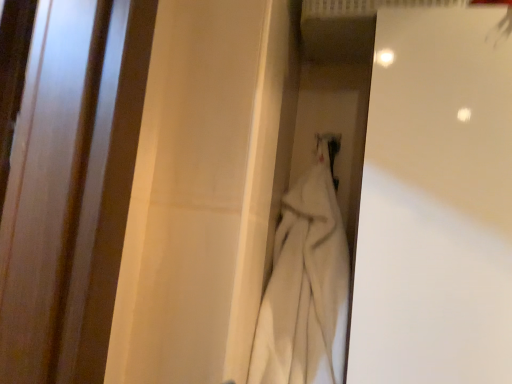
Question: Should I look upward or downward to see white glossy door at upper right?

Choices:
 (A) up
 (B) down

Answer: (B)